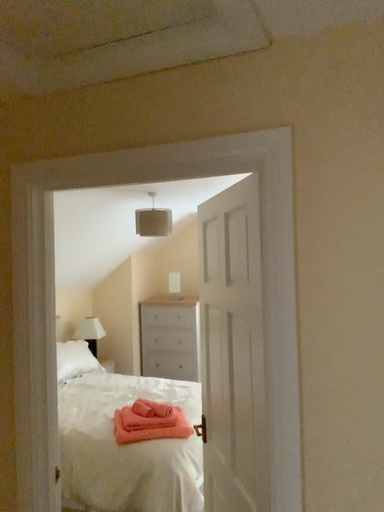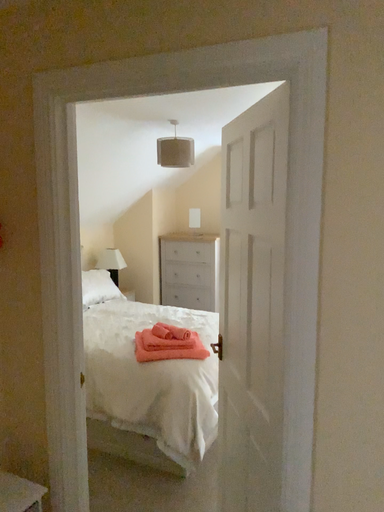
Question: How did the camera likely rotate when shooting the video?

Choices:
 (A) rotated upward
 (B) rotated downward

Answer: (B)